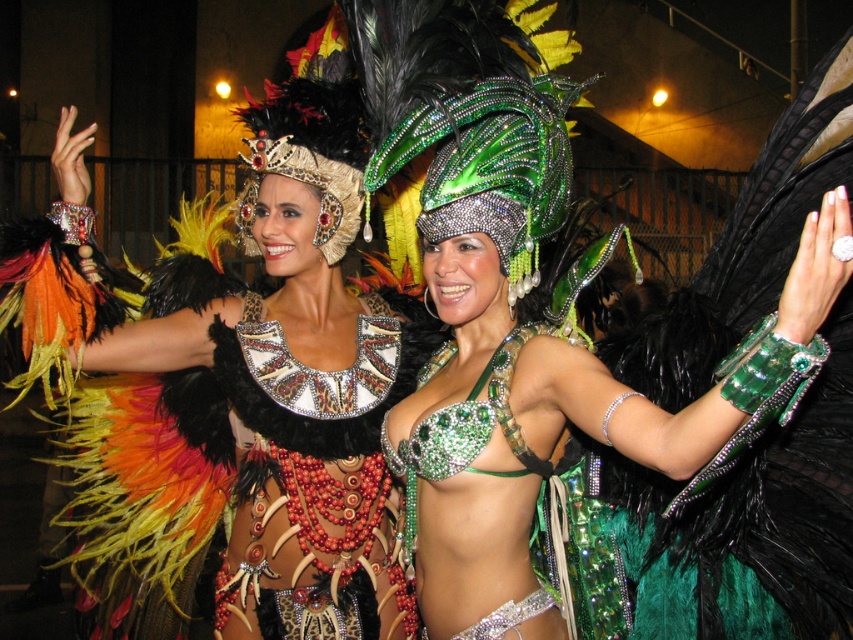
Can you confirm if green shiny headdress at center is taller than leather/embellished dress at center?

Indeed, green shiny headdress at center has a greater height compared to leather/embellished dress at center.

Which of these two, green shiny headdress at center or leather/embellished dress at center, stands shorter?

leather/embellished dress at center is shorter.

Identify the location of green shiny headdress at center. The image size is (853, 640). (743, 513).

Locate an element on the screen. shiny metallic headdress at upper center is located at coordinates (230, 390).

In the scene shown: Who is lower down, shiny metallic headdress at upper center or leather/embellished dress at center?

leather/embellished dress at center is below.

Does point (103, 401) come farther from viewer compared to point (364, 628)?

That is True.

Locate an element on the screen. shiny metallic headdress at upper center is located at coordinates (230, 390).

Does shiny metallic headdress at upper center appear on the right side of green shiny headdress at center?

No, shiny metallic headdress at upper center is not to the right of green shiny headdress at center.

Where is `shiny metallic headdress at upper center`? The width and height of the screenshot is (853, 640). shiny metallic headdress at upper center is located at coordinates pos(230,390).

Identify the location of shiny metallic headdress at upper center. (230, 390).